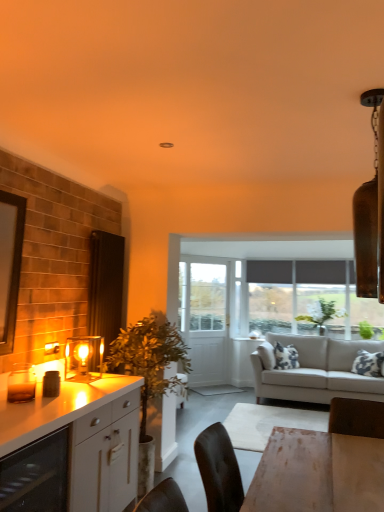
Where is `vacant space in front of matte glass lampshade at left`? This screenshot has height=512, width=384. vacant space in front of matte glass lampshade at left is located at coordinates (84, 384).